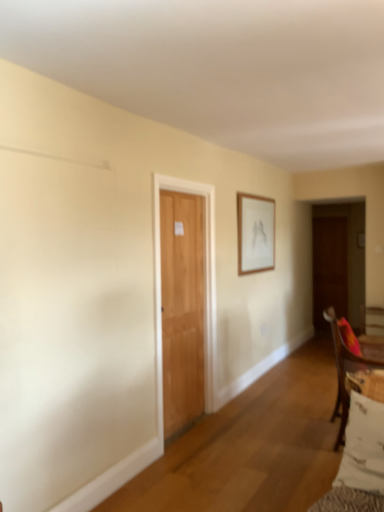
The image size is (384, 512). I want to click on brown wooden door at right, which ranks as the 2th door in left-to-right order, so click(329, 268).

Where is `white cotton pillow at lower right`? white cotton pillow at lower right is located at coordinates (363, 446).

Where is `wooden frame at upper center`? This screenshot has width=384, height=512. wooden frame at upper center is located at coordinates (255, 233).

Measure the distance between point (376, 362) and camera.

The distance of point (376, 362) from camera is 2.78 meters.

Identify the location of brown wooden door at right, the second door viewed from the front. The width and height of the screenshot is (384, 512). (329, 268).

Considering the sizes of objects light brown wooden door at center, the first door when ordered from front to back, and wooden frame at upper center in the image provided, who is smaller, light brown wooden door at center, the first door when ordered from front to back, or wooden frame at upper center?

With smaller size is wooden frame at upper center.

Which is closer, (154, 287) or (247, 229)?

The point (154, 287) is more forward.

Is there a large distance between light brown wooden door at center, marked as the second door in a right-to-left arrangement, and wooden frame at upper center?

They are positioned close to each other.

How different are the orientations of light brown wooden door at center, positioned as the 1th door in left-to-right order, and wooden frame at upper center in degrees?

They differ by 0.386 degrees in their facing directions.

Are brown wooden door at right, the second door viewed from the front, and wooden frame at upper center located far from each other?

brown wooden door at right, the second door viewed from the front, is positioned a significant distance from wooden frame at upper center.

Looking at this image, considering the positions of objects brown wooden door at right, which ranks as the 2th door in left-to-right order, and wooden frame at upper center in the image provided, who is more to the right, brown wooden door at right, which ranks as the 2th door in left-to-right order, or wooden frame at upper center?

brown wooden door at right, which ranks as the 2th door in left-to-right order.

Does brown wooden door at right, marked as the first door in a right-to-left arrangement, have a greater height compared to wooden frame at upper center?

Yes.

Which object is more forward, brown wooden door at right, marked as the first door in a right-to-left arrangement, or wooden frame at upper center?

wooden frame at upper center is closer to the camera.

From a real-world perspective, is wooden chair at lower right located higher than white cotton pillow at lower right?

No.

This screenshot has width=384, height=512. What are the coordinates of `chair to the right of white cotton pillow at lower right` in the screenshot? It's located at (344, 370).

Does wooden chair at lower right have a greater width compared to white cotton pillow at lower right?

Yes, wooden chair at lower right is wider than white cotton pillow at lower right.

Does point (347, 413) come closer to viewer compared to point (360, 407)?

That is False.

Is wooden frame at upper center taller or shorter than light brown wooden door at center, marked as the second door in a right-to-left arrangement?

Clearly, wooden frame at upper center is shorter compared to light brown wooden door at center, marked as the second door in a right-to-left arrangement.

Consider the image. What's the angular difference between wooden frame at upper center and light brown wooden door at center, the first door when ordered from front to back,'s facing directions?

The angle between the facing direction of wooden frame at upper center and the facing direction of light brown wooden door at center, the first door when ordered from front to back, is 0.386 degrees.

Considering the relative sizes of wooden frame at upper center and light brown wooden door at center, which is the second door from back to front, in the image provided, is wooden frame at upper center bigger than light brown wooden door at center, which is the second door from back to front,?

Actually, wooden frame at upper center might be smaller than light brown wooden door at center, which is the second door from back to front.

From a real-world perspective, count 1st doors downward from the wooden frame at upper center and point to it. Please provide its 2D coordinates.

[(205, 291)]

The image size is (384, 512). I want to click on door to the right of wooden chair at lower right, so pyautogui.click(x=329, y=268).

Looking at their sizes, would you say wooden chair at lower right is wider or thinner than brown wooden door at right, which ranks as the 2th door in left-to-right order?

wooden chair at lower right is wider than brown wooden door at right, which ranks as the 2th door in left-to-right order.

Is point (340, 440) farther from viewer compared to point (336, 306)?

No.

Based on their positions, is wooden frame at upper center located to the left or right of wooden chair at lower right?

wooden frame at upper center is to the left of wooden chair at lower right.

Based on the photo, which of these two, wooden frame at upper center or wooden chair at lower right, stands taller?

→ With more height is wooden chair at lower right.

In the scene shown: Is wooden frame at upper center in contact with wooden chair at lower right?

No, wooden frame at upper center is not beside wooden chair at lower right.

Between point (240, 209) and point (347, 349), which one is positioned behind?

Point (240, 209)

From the picture: Who is shorter, white cotton pillow at lower right or wooden frame at upper center?

white cotton pillow at lower right is shorter.

In the image, is white cotton pillow at lower right positioned in front of or behind wooden frame at upper center?

white cotton pillow at lower right is in front of wooden frame at upper center.

From the image's perspective, relative to wooden frame at upper center, is white cotton pillow at lower right above or below?

From the image's perspective, white cotton pillow at lower right appears below wooden frame at upper center.

Is white cotton pillow at lower right in contact with wooden frame at upper center?

white cotton pillow at lower right and wooden frame at upper center are not in contact.

From the image's perspective, starting from the wooden frame at upper center, which door is the 2nd one below? Please provide its 2D coordinates.

[(205, 291)]

At what (x,y) coordinates should I click in order to perform the action: click on picture frame above the brown wooden door at right, which ranks as the 2th door in left-to-right order (from the image's perspective). Please return your answer as a coordinate pair (x, y). Looking at the image, I should click on (255, 233).

Based on their spatial positions, is white cotton pillow at lower right or brown wooden door at right, which ranks as the 2th door in left-to-right order, further from light brown wooden door at center, marked as the second door in a right-to-left arrangement?

brown wooden door at right, which ranks as the 2th door in left-to-right order, is positioned further to the anchor light brown wooden door at center, marked as the second door in a right-to-left arrangement.

From the image, which object appears to be nearer to wooden frame at upper center, brown wooden door at right, which ranks as the 2th door in left-to-right order, or white cotton pillow at lower right?

brown wooden door at right, which ranks as the 2th door in left-to-right order.

Based on their spatial positions, is wooden chair at lower right or light brown wooden door at center, marked as the second door in a right-to-left arrangement, further from wooden frame at upper center?

wooden chair at lower right lies further to wooden frame at upper center than the other object.

Looking at the image, which one is located closer to wooden chair at lower right, wooden frame at upper center or light brown wooden door at center, positioned as the 1th door in left-to-right order?

Based on the image, light brown wooden door at center, positioned as the 1th door in left-to-right order, appears to be nearer to wooden chair at lower right.

Estimate the real-world distances between objects in this image. Which object is closer to white cotton pillow at lower right, brown wooden door at right, the second door viewed from the front, or wooden chair at lower right?

The object closer to white cotton pillow at lower right is wooden chair at lower right.

From the image, which object appears to be farther from wooden frame at upper center, white cotton pillow at lower right or wooden chair at lower right?

white cotton pillow at lower right.

When comparing their distances from wooden chair at lower right, does white cotton pillow at lower right or wooden frame at upper center seem further?

wooden frame at upper center lies further to wooden chair at lower right than the other object.

From the image, which object appears to be nearer to wooden frame at upper center, light brown wooden door at center, which is the second door from back to front, or white cotton pillow at lower right?

light brown wooden door at center, which is the second door from back to front.

The width and height of the screenshot is (384, 512). I want to click on picture frame located between wooden chair at lower right and brown wooden door at right, the first door positioned from the back, in the depth direction, so click(x=255, y=233).

This screenshot has height=512, width=384. Identify the location of door between wooden chair at lower right and wooden frame at upper center along the z-axis. (205, 291).

I want to click on door between wooden chair at lower right and brown wooden door at right, which ranks as the 2th door in left-to-right order, in the front-back direction, so click(205, 291).

Where is `picture frame between white cotton pillow at lower right and brown wooden door at right, the second door viewed from the front, along the z-axis`? This screenshot has width=384, height=512. picture frame between white cotton pillow at lower right and brown wooden door at right, the second door viewed from the front, along the z-axis is located at coordinates (255, 233).